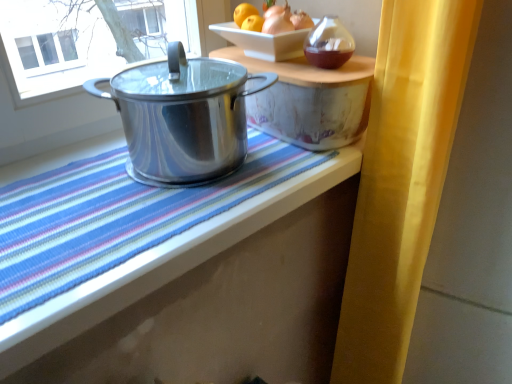
This screenshot has width=512, height=384. Identify the location of vacant space underneath shiny metallic pot at left (from a real-world perspective). (198, 173).